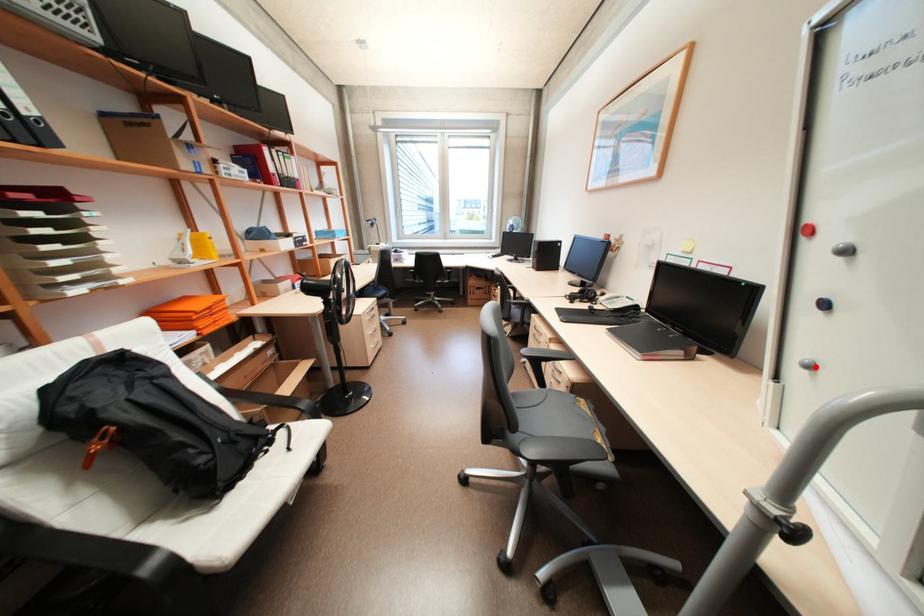
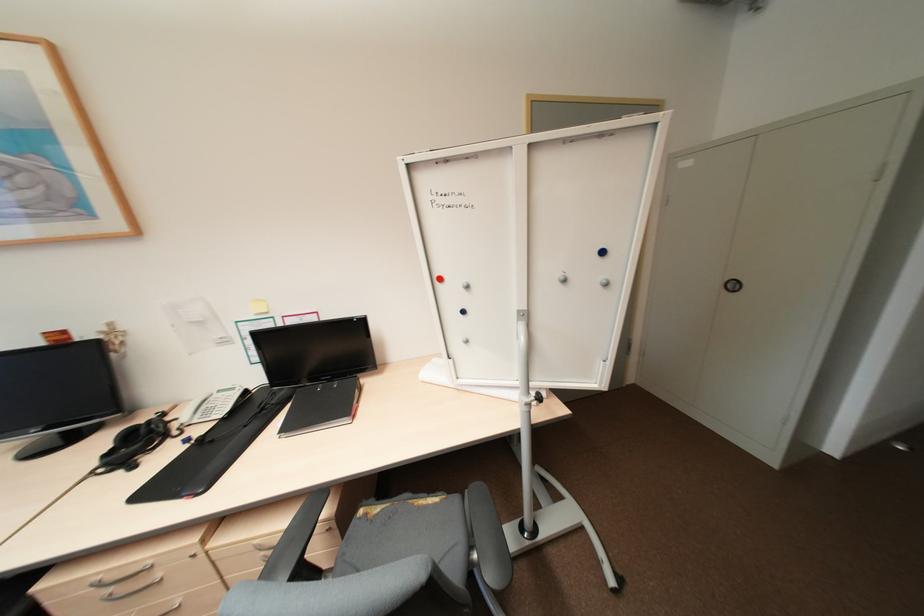
In the second image, find the point that corresponds to the highlighted location in the first image.

(472, 341)